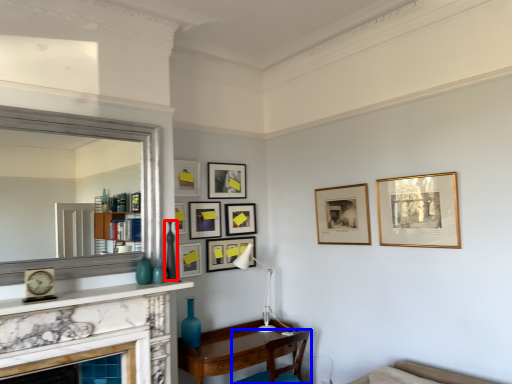
Question: Which point is further to the camera, vase (highlighted by a red box) or chair (highlighted by a blue box)?

Choices:
 (A) vase
 (B) chair

Answer: (B)